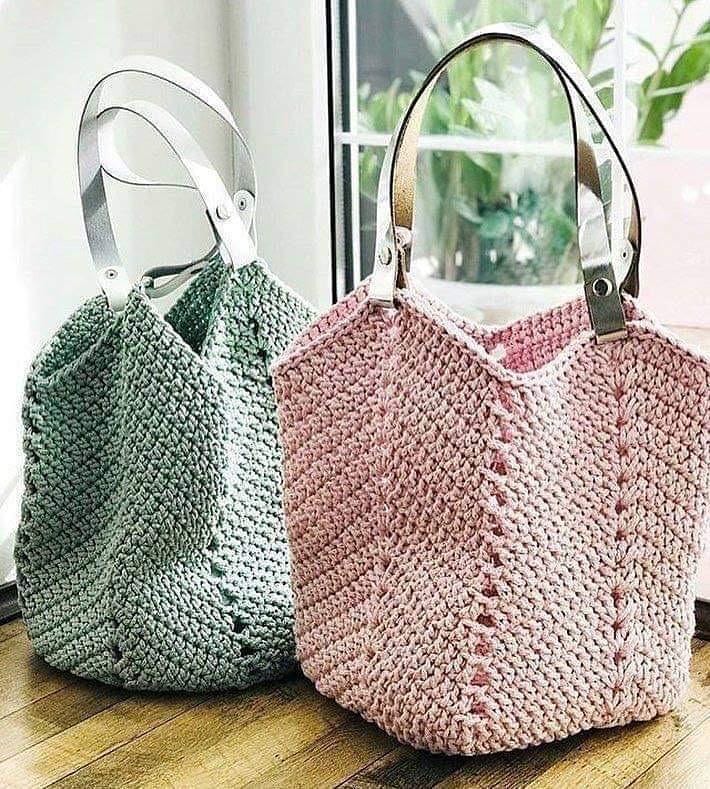
Locate an element on the screen. plant is located at coordinates (687, 66).